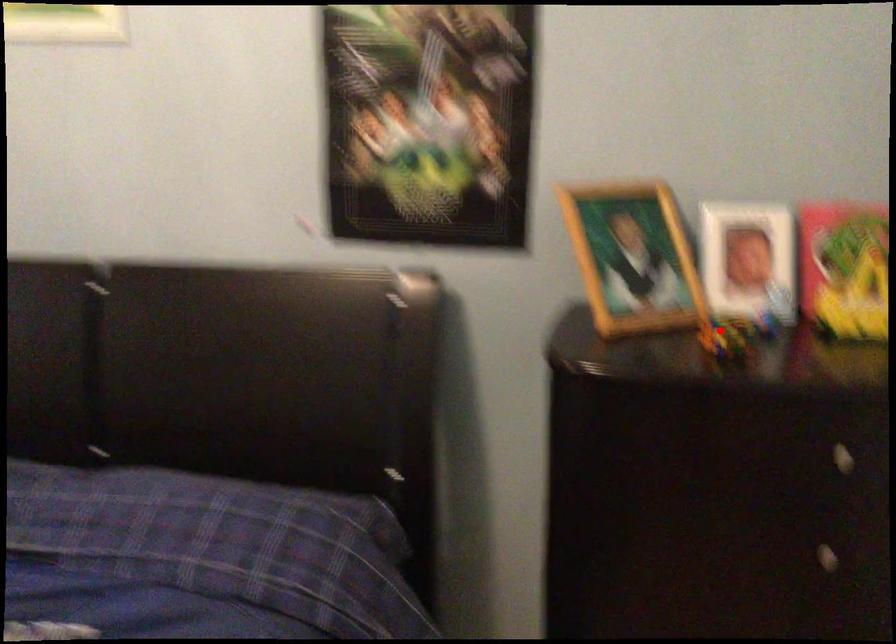
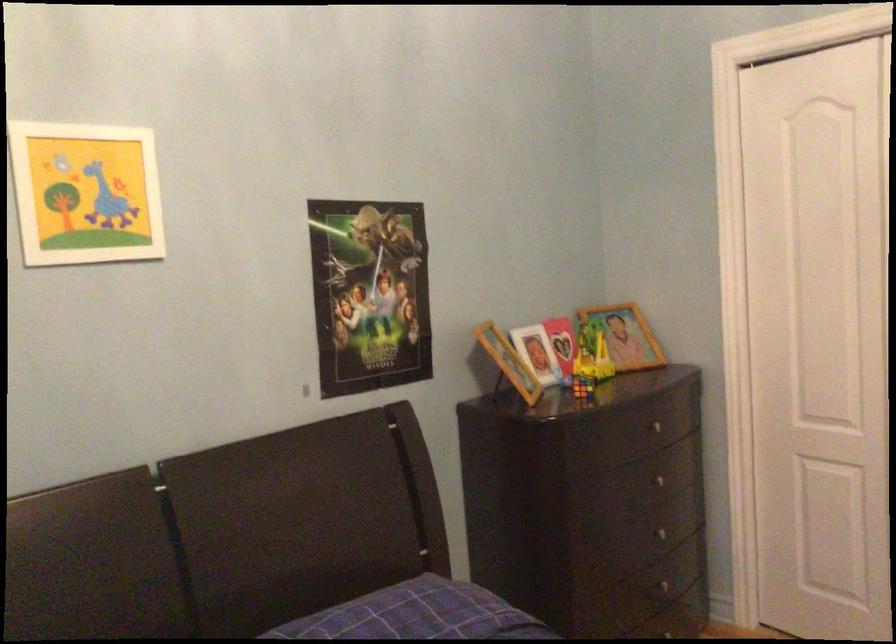
Question: I am providing you with two images of the same scene from different viewpoints. A red point is shown in image1. For the corresponding object point in image2, is it positioned nearer or farther from the camera?

Choices:
 (A) Nearer
 (B) Farther

Answer: (B)